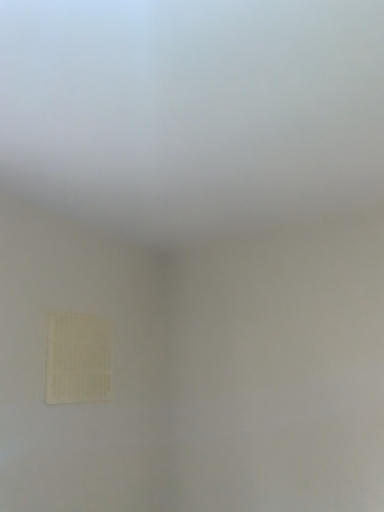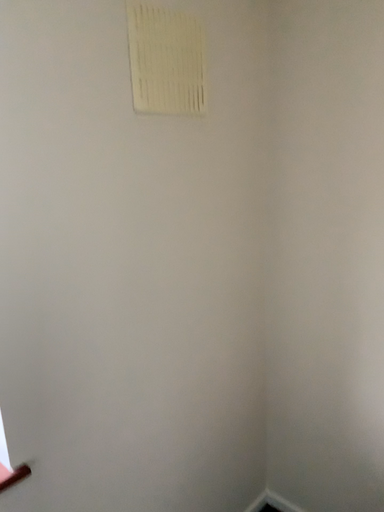
Question: How did the camera likely rotate when shooting the video?

Choices:
 (A) rotated left
 (B) rotated right

Answer: (A)